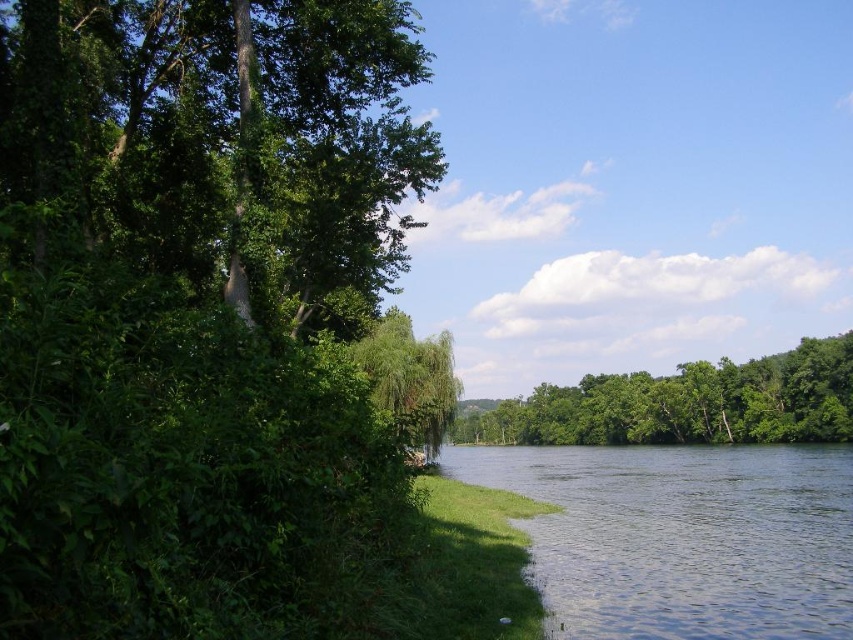
You are standing at the point represented by point (196,307) in the scene. Which direction should you walk to reach the green leafy tree at left?

The point (196,307) represents the green leafy tree at left, so you are already at the tree.

You are standing at the center of the image and want to locate the green leafy tree at left. In which direction should you look?

You should look to the left to find the green leafy tree at left as it is located at the left side of the image.

You are standing at the edge of the serene natural landscape described. There is a specific point marked at coordinates point (144,154). If you want to reach that point without getting wet, what should you be cautious of based on the scene?

The point (144,154) is 61.74 feet away from the viewer. Since the right side of the scene has a tranquil river or lake with calm water, you should be cautious of the water when moving towards the point to avoid getting wet.